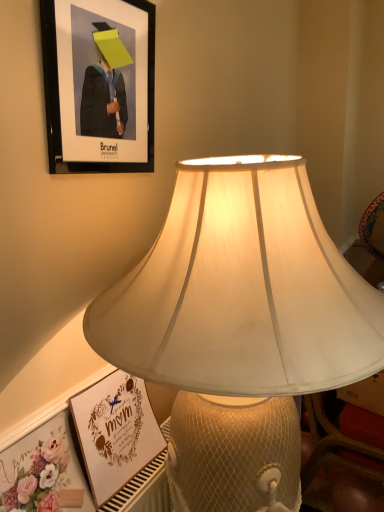
Where is `black matte picture frame at upper left, marked as the 1th picture frame in a top-to-bottom arrangement`? black matte picture frame at upper left, marked as the 1th picture frame in a top-to-bottom arrangement is located at coordinates (99, 85).

Is matte white frame at lower left, the 1th picture frame when ordered from bottom to top, facing towards black matte picture frame at upper left, marked as the 1th picture frame in a top-to-bottom arrangement?

No, matte white frame at lower left, the 1th picture frame when ordered from bottom to top, is not turned towards black matte picture frame at upper left, marked as the 1th picture frame in a top-to-bottom arrangement.

Considering the relative positions of matte white frame at lower left, marked as the 2th picture frame in a top-to-bottom arrangement, and black matte picture frame at upper left, marked as the 1th picture frame in a top-to-bottom arrangement, in the image provided, is matte white frame at lower left, marked as the 2th picture frame in a top-to-bottom arrangement, to the right of black matte picture frame at upper left, marked as the 1th picture frame in a top-to-bottom arrangement, from the viewer's perspective?

Correct, you'll find matte white frame at lower left, marked as the 2th picture frame in a top-to-bottom arrangement, to the right of black matte picture frame at upper left, marked as the 1th picture frame in a top-to-bottom arrangement.

In terms of height, does matte white frame at lower left, marked as the 2th picture frame in a top-to-bottom arrangement, look taller or shorter compared to black matte picture frame at upper left, marked as the 1th picture frame in a top-to-bottom arrangement?

In the image, matte white frame at lower left, marked as the 2th picture frame in a top-to-bottom arrangement, appears to be shorter than black matte picture frame at upper left, marked as the 1th picture frame in a top-to-bottom arrangement.

At what (x,y) coordinates should I click in order to perform the action: click on picture frame that is above the matte white frame at lower left, the 1th picture frame when ordered from bottom to top (from the image's perspective). Please return your answer as a coordinate pair (x, y). The height and width of the screenshot is (512, 384). Looking at the image, I should click on (99, 85).

From a real-world perspective, is matte white lampshade at center physically located above or below floral paper at lower left?

matte white lampshade at center is above floral paper at lower left.

Would you say matte white lampshade at center is to the left or to the right of floral paper at lower left in the picture?

From the image, it's evident that matte white lampshade at center is to the right of floral paper at lower left.

Looking at the image, does matte white lampshade at center seem bigger or smaller compared to floral paper at lower left?

In the image, matte white lampshade at center appears to be larger than floral paper at lower left.

From the image's perspective, is black matte picture frame at upper left, marked as the 2th picture frame in a bottom-to-top arrangement, beneath floral paper at lower left?

No, from the image's perspective, black matte picture frame at upper left, marked as the 2th picture frame in a bottom-to-top arrangement, is not below floral paper at lower left.

The width and height of the screenshot is (384, 512). Find the location of `the 2nd picture frame above the floral paper at lower left (from the image's perspective)`. the 2nd picture frame above the floral paper at lower left (from the image's perspective) is located at coordinates (99, 85).

Can you confirm if black matte picture frame at upper left, marked as the 2th picture frame in a bottom-to-top arrangement, is thinner than floral paper at lower left?

Correct, the width of black matte picture frame at upper left, marked as the 2th picture frame in a bottom-to-top arrangement, is less than that of floral paper at lower left.

Who is shorter, black matte picture frame at upper left, marked as the 2th picture frame in a bottom-to-top arrangement, or floral paper at lower left?

floral paper at lower left is shorter.

Is point (95, 301) more distant than point (123, 500)?

That is False.

Looking at this image, could you tell me if matte white lampshade at center is facing matte white frame at lower left, the 1th picture frame when ordered from bottom to top?

Yes.

From the image's perspective, between matte white lampshade at center and matte white frame at lower left, the 1th picture frame when ordered from bottom to top, which one is located above?

matte white lampshade at center is shown above in the image.

Can you confirm if matte white lampshade at center is bigger than matte white frame at lower left, marked as the 2th picture frame in a top-to-bottom arrangement?

Yes.

You are a GUI agent. You are given a task and a screenshot of the screen. Output one action in this format:
    pyautogui.click(x=<x>, y=<y>)
    Task: Click on the picture frame that is the 2nd object located behind the matte white lampshade at center
    
    Given the screenshot: What is the action you would take?
    pyautogui.click(x=117, y=438)

Is point (83, 393) more distant than point (118, 287)?

Yes, point (83, 393) is behind point (118, 287).

Can you confirm if matte white frame at lower left, marked as the 2th picture frame in a top-to-bottom arrangement, is thinner than matte white lampshade at center?

Correct, the width of matte white frame at lower left, marked as the 2th picture frame in a top-to-bottom arrangement, is less than that of matte white lampshade at center.

From the picture: Considering the relative positions of black matte picture frame at upper left, marked as the 2th picture frame in a bottom-to-top arrangement, and matte white lampshade at center in the image provided, is black matte picture frame at upper left, marked as the 2th picture frame in a bottom-to-top arrangement, to the left or to the right of matte white lampshade at center?

Clearly, black matte picture frame at upper left, marked as the 2th picture frame in a bottom-to-top arrangement, is on the left of matte white lampshade at center in the image.

Can you confirm if black matte picture frame at upper left, marked as the 1th picture frame in a top-to-bottom arrangement, is thinner than matte white lampshade at center?

Yes, black matte picture frame at upper left, marked as the 1th picture frame in a top-to-bottom arrangement, is thinner than matte white lampshade at center.

Which is closer to the camera, (56,53) or (252,234)?

Point (56,53) is positioned farther from the camera compared to point (252,234).

Between floral paper at lower left and matte white lampshade at center, which one has smaller size?

Smaller between the two is floral paper at lower left.

Consider the image. Could you tell me if floral paper at lower left is facing matte white lampshade at center?

No, floral paper at lower left does not turn towards matte white lampshade at center.

From the image's perspective, is floral paper at lower left located above matte white lampshade at center?

No, from the image's perspective, floral paper at lower left is not above matte white lampshade at center.

Identify the location of picture frame that appears below the black matte picture frame at upper left, marked as the 1th picture frame in a top-to-bottom arrangement (from the image's perspective). (117, 438).

The height and width of the screenshot is (512, 384). What are the coordinates of `lamp that is on the right side of floral paper at lower left` in the screenshot? It's located at (242, 290).

Estimate the real-world distances between objects in this image. Which object is further from matte white lampshade at center, black matte picture frame at upper left, marked as the 2th picture frame in a bottom-to-top arrangement, or floral paper at lower left?

Based on the image, floral paper at lower left appears to be further to matte white lampshade at center.

When comparing their distances from matte white lampshade at center, does matte white frame at lower left, the 1th picture frame when ordered from bottom to top, or floral paper at lower left seem further?

floral paper at lower left is positioned further to the anchor matte white lampshade at center.

From the image, which object appears to be farther from black matte picture frame at upper left, marked as the 2th picture frame in a bottom-to-top arrangement, floral paper at lower left or matte white frame at lower left, the 1th picture frame when ordered from bottom to top?

floral paper at lower left is further to black matte picture frame at upper left, marked as the 2th picture frame in a bottom-to-top arrangement.

Which object lies nearer to the anchor point matte white frame at lower left, the 1th picture frame when ordered from bottom to top, floral paper at lower left or matte white lampshade at center?

floral paper at lower left is positioned closer to the anchor matte white frame at lower left, the 1th picture frame when ordered from bottom to top.

When comparing their distances from floral paper at lower left, does black matte picture frame at upper left, marked as the 2th picture frame in a bottom-to-top arrangement, or matte white lampshade at center seem closer?

The object closer to floral paper at lower left is matte white lampshade at center.

Looking at the image, which one is located closer to matte white lampshade at center, matte white frame at lower left, the 1th picture frame when ordered from bottom to top, or black matte picture frame at upper left, marked as the 2th picture frame in a bottom-to-top arrangement?

Based on the image, black matte picture frame at upper left, marked as the 2th picture frame in a bottom-to-top arrangement, appears to be nearer to matte white lampshade at center.

From the image, which object appears to be nearer to matte white lampshade at center, floral paper at lower left or matte white frame at lower left, marked as the 2th picture frame in a top-to-bottom arrangement?

matte white frame at lower left, marked as the 2th picture frame in a top-to-bottom arrangement, is positioned closer to the anchor matte white lampshade at center.

Which object lies further to the anchor point matte white lampshade at center, floral paper at lower left or black matte picture frame at upper left, marked as the 2th picture frame in a bottom-to-top arrangement?

floral paper at lower left lies further to matte white lampshade at center than the other object.

The height and width of the screenshot is (512, 384). I want to click on flower between matte white lampshade at center and matte white frame at lower left, marked as the 2th picture frame in a top-to-bottom arrangement, along the z-axis, so click(x=39, y=478).

Where is `lamp that lies between black matte picture frame at upper left, marked as the 1th picture frame in a top-to-bottom arrangement, and floral paper at lower left from top to bottom`? Image resolution: width=384 pixels, height=512 pixels. lamp that lies between black matte picture frame at upper left, marked as the 1th picture frame in a top-to-bottom arrangement, and floral paper at lower left from top to bottom is located at coordinates (242, 290).

At what (x,y) coordinates should I click in order to perform the action: click on lamp between black matte picture frame at upper left, marked as the 2th picture frame in a bottom-to-top arrangement, and matte white frame at lower left, the 1th picture frame when ordered from bottom to top, in the up-down direction. Please return your answer as a coordinate pair (x, y). Looking at the image, I should click on (242, 290).

Locate an element on the screen. picture frame that lies between black matte picture frame at upper left, marked as the 2th picture frame in a bottom-to-top arrangement, and floral paper at lower left from top to bottom is located at coordinates (117, 438).